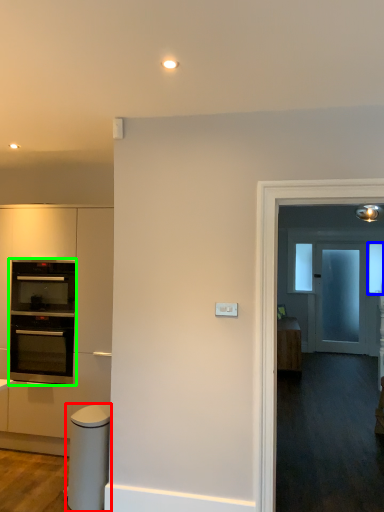
Question: Which is farther away from appliance (highlighted by a red box)? window (highlighted by a blue box) or oven (highlighted by a green box)?

Choices:
 (A) window
 (B) oven

Answer: (A)